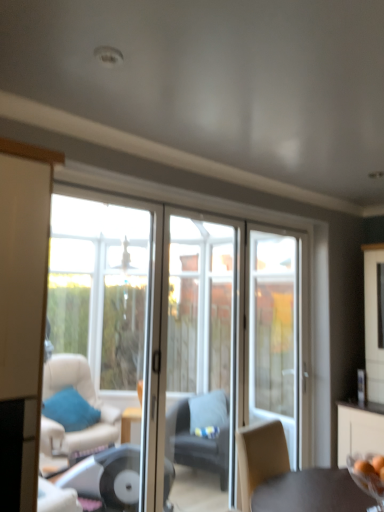
What is the approximate width of white glass door at center?

white glass door at center is 2.82 inches in width.

Describe the element at coordinates (202, 345) in the screenshot. I see `clear glass screen door at center, which is the first screen door from left to right` at that location.

This screenshot has width=384, height=512. What do you see at coordinates (275, 333) in the screenshot?
I see `clear glass door at center, which is the first screen door in right-to-left order` at bounding box center [275, 333].

Measure the distance between transparent glass window at left and camera.

They are 4.30 meters apart.

This screenshot has height=512, width=384. I want to click on white glass door at center, so click(x=179, y=324).

Could clear glass screen door at center, marked as the second screen door in a right-to-left arrangement, be considered to be inside blue fabric pillow at lower left?

No, clear glass screen door at center, marked as the second screen door in a right-to-left arrangement, is located outside of blue fabric pillow at lower left.

Is blue fabric pillow at lower left aimed at clear glass screen door at center, which is the first screen door from left to right?

Yes.

From a real-world perspective, relative to clear glass screen door at center, which is the first screen door from left to right, is blue fabric pillow at lower left vertically above or below?

Clearly, from a real-world perspective, blue fabric pillow at lower left is below clear glass screen door at center, which is the first screen door from left to right.

From the image's perspective, is transparent glass window at left below clear glass screen door at center, marked as the second screen door in a right-to-left arrangement?

No.

Is point (108, 279) behind point (181, 290)?

Yes, it is.

Based on the photo, is transparent glass window at left closer to camera compared to clear glass screen door at center, which is the first screen door from left to right?

That is True.

In the image, is white glass door at center on the left side or the right side of clear glass screen door at center, marked as the second screen door in a right-to-left arrangement?

From the image, it's evident that white glass door at center is to the right of clear glass screen door at center, marked as the second screen door in a right-to-left arrangement.

Considering the sizes of objects white glass door at center and clear glass screen door at center, which is the first screen door from left to right, in the image provided, who is taller, white glass door at center or clear glass screen door at center, which is the first screen door from left to right,?

white glass door at center is taller.

From the image's perspective, does white glass door at center appear higher than clear glass screen door at center, marked as the second screen door in a right-to-left arrangement?

Correct, white glass door at center appears higher than clear glass screen door at center, marked as the second screen door in a right-to-left arrangement, in the image.

Who is bigger, white glass door at center or clear glass screen door at center, which is the first screen door from left to right?

white glass door at center is bigger.

Between point (51, 438) and point (61, 283), which one is positioned behind?

Positioned behind is point (61, 283).

Is white glass door at center facing towards transparent glass window at left?

Yes, white glass door at center is aimed at transparent glass window at left.

What's the angular difference between white glass door at center and transparent glass window at left's facing directions?

The facing directions of white glass door at center and transparent glass window at left are 0.00048 degrees apart.

From the image's perspective, which is below, white glass door at center or clear glass door at center, which is the first screen door in right-to-left order?

clear glass door at center, which is the first screen door in right-to-left order, from the image's perspective.

From a real-world perspective, which is physically above, white glass door at center or clear glass door at center, the second screen door in the left-to-right sequence?

clear glass door at center, the second screen door in the left-to-right sequence.

Is white glass door at center in front of clear glass door at center, the second screen door in the left-to-right sequence?

Yes, white glass door at center is closer to the viewer.

From the image's perspective, which object appears higher, clear glass door at center, the second screen door in the left-to-right sequence, or white glass door at center?

white glass door at center appears higher in the image.

Are clear glass door at center, the second screen door in the left-to-right sequence, and white glass door at center making contact?

No, clear glass door at center, the second screen door in the left-to-right sequence, is not next to white glass door at center.

Can you confirm if clear glass door at center, which is the first screen door in right-to-left order, is taller than white glass door at center?

No.

Which object is positioned more to the right, clear glass door at center, which is the first screen door in right-to-left order, or white glass door at center?

From the viewer's perspective, clear glass door at center, which is the first screen door in right-to-left order, appears more on the right side.

Does clear glass door at center, the second screen door in the left-to-right sequence, contain blue fabric pillow at lower left?

No, blue fabric pillow at lower left is not inside clear glass door at center, the second screen door in the left-to-right sequence.

Looking at their sizes, would you say clear glass door at center, the second screen door in the left-to-right sequence, is wider or thinner than blue fabric pillow at lower left?

clear glass door at center, the second screen door in the left-to-right sequence, is thinner than blue fabric pillow at lower left.

From the picture: Which is in front, clear glass door at center, the second screen door in the left-to-right sequence, or blue fabric pillow at lower left?

clear glass door at center, the second screen door in the left-to-right sequence, is in front.

Considering the sizes of objects clear glass door at center, the second screen door in the left-to-right sequence, and blue fabric pillow at lower left in the image provided, who is smaller, clear glass door at center, the second screen door in the left-to-right sequence, or blue fabric pillow at lower left?

blue fabric pillow at lower left.

From a real-world perspective, count 1st screen doors upward from the blue fabric pillow at lower left and point to it. Please provide its 2D coordinates.

[(202, 345)]

Where is `window that is above the clear glass screen door at center, marked as the second screen door in a right-to-left arrangement (from the image's perspective)`? window that is above the clear glass screen door at center, marked as the second screen door in a right-to-left arrangement (from the image's perspective) is located at coordinates (102, 286).

Which object lies nearer to the anchor point transparent glass window at left, white glass door at center or dark gray fabric chair at center?

Based on the image, white glass door at center appears to be nearer to transparent glass window at left.

Which object lies further to the anchor point transparent glass window at left, blue fabric pillow at lower left or transparent glass bowl at lower right?

Among the two, transparent glass bowl at lower right is located further to transparent glass window at left.

From the image, which object appears to be farther from clear glass door at center, the second screen door in the left-to-right sequence, dark gray fabric chair at center or transparent glass window at left?

transparent glass window at left is further to clear glass door at center, the second screen door in the left-to-right sequence.

When comparing their distances from white glass door at center, does clear glass door at center, which is the first screen door in right-to-left order, or transparent glass window at left seem further?

Among the two, transparent glass window at left is located further to white glass door at center.

Estimate the real-world distances between objects in this image. Which object is further from clear glass door at center, the second screen door in the left-to-right sequence, transparent glass window at left or white glass door at center?

transparent glass window at left lies further to clear glass door at center, the second screen door in the left-to-right sequence, than the other object.

Based on their spatial positions, is clear glass screen door at center, marked as the second screen door in a right-to-left arrangement, or transparent glass window at left closer to dark gray fabric chair at center?

clear glass screen door at center, marked as the second screen door in a right-to-left arrangement.

Considering their positions, is white glass door at center positioned further to transparent glass window at left than clear glass door at center, which is the first screen door in right-to-left order?

clear glass door at center, which is the first screen door in right-to-left order, lies further to transparent glass window at left than the other object.

Based on their spatial positions, is transparent glass window at left or clear glass door at center, which is the first screen door in right-to-left order, closer to white glass door at center?

The object closer to white glass door at center is clear glass door at center, which is the first screen door in right-to-left order.

I want to click on screen door between transparent glass window at left and white glass door at center in the horizontal direction, so click(202, 345).

Locate an element on the screen. This screenshot has height=512, width=384. screen door situated between blue fabric pillow at lower left and clear glass door at center, which is the first screen door in right-to-left order, from left to right is located at coordinates (202, 345).

This screenshot has height=512, width=384. I want to click on window located between white glass door at center and dark gray fabric chair at center in the depth direction, so pyautogui.click(x=102, y=286).

You are a GUI agent. You are given a task and a screenshot of the screen. Output one action in this format:
    pyautogui.click(x=<x>, y=<y>)
    Task: Click on the chair located between clear glass screen door at center, which is the first screen door from left to right, and blue fabric pillow at lower left in the depth direction
    The width and height of the screenshot is (384, 512).
    Given the screenshot: What is the action you would take?
    pyautogui.click(x=198, y=436)